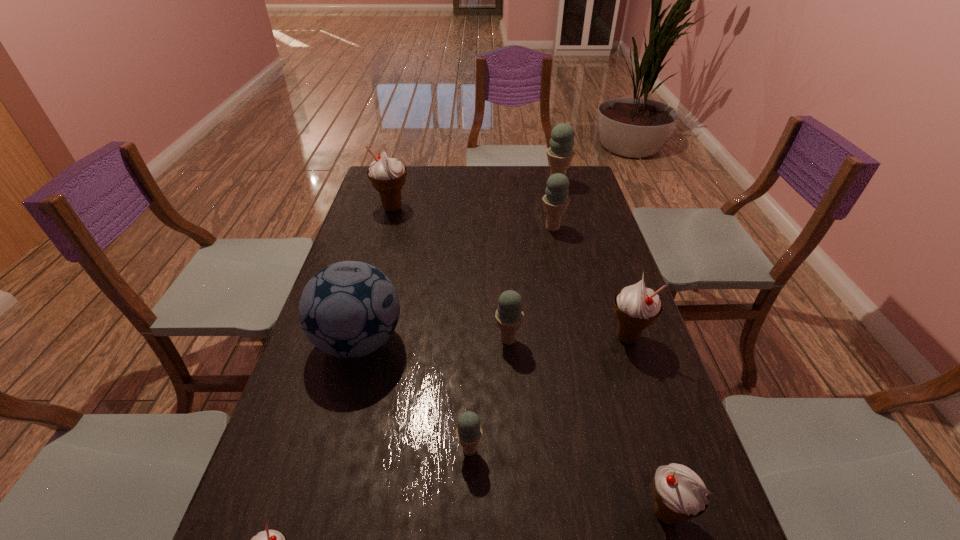
This screenshot has height=540, width=960. What are the coordinates of `the second blue ice cream from left to right` in the screenshot? It's located at (509, 315).

Where is `the fourth icecream from left to right`? Image resolution: width=960 pixels, height=540 pixels. the fourth icecream from left to right is located at coordinates click(x=509, y=315).

Locate an element on the screen. This screenshot has width=960, height=540. the sixth icecream from right to left is located at coordinates (x=468, y=431).

At what (x,y) coordinates should I click in order to perform the action: click on the fourth object from left to right. Please return your answer as a coordinate pair (x, y). The image size is (960, 540). Looking at the image, I should click on (468, 431).

Locate an element on the screen. This screenshot has height=540, width=960. vacant space located 0.090m on the back of the biggest blue ice cream is located at coordinates (552, 167).

Where is `vacant space positioned 0.070m on the right of the biggest white icecream`? The height and width of the screenshot is (540, 960). vacant space positioned 0.070m on the right of the biggest white icecream is located at coordinates (429, 208).

Identify the location of free space located on the side with brand of the blue soccer ball. (446, 341).

Locate an element on the screen. This screenshot has width=960, height=540. free space located on the back of the third smallest blue ice cream is located at coordinates (544, 188).

Identify the location of free point located 0.190m on the front of the second farthest white icecream. (655, 421).

This screenshot has width=960, height=540. What are the coordinates of `vacant space positioned 0.130m on the back of the third biggest white icecream` in the screenshot? It's located at (640, 429).